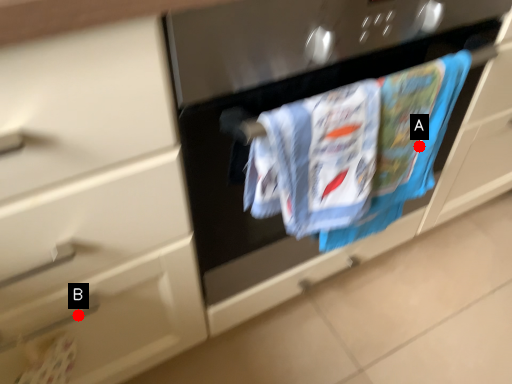
Question: Two points are circled on the image, labeled by A and B beside each circle. Which of the following is the closest to the observer?

Choices:
 (A) A is closer
 (B) B is closer

Answer: (B)